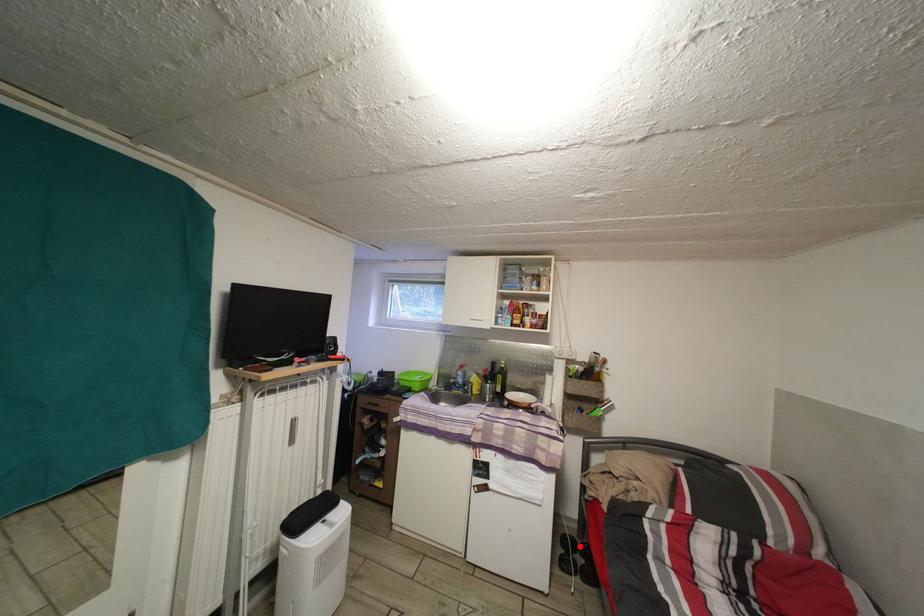
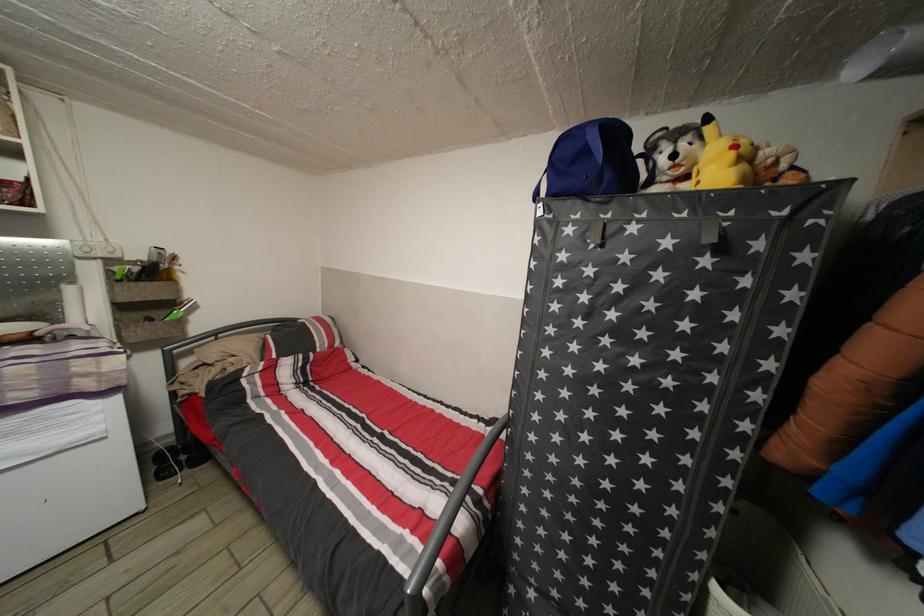
Question: I am providing you with two images of the same scene from different viewpoints. Given a red point in image1, look at the same physical point in image2. Is it:

Choices:
 (A) Closer to the viewpoint
 (B) Farther from the viewpoint

Answer: (B)